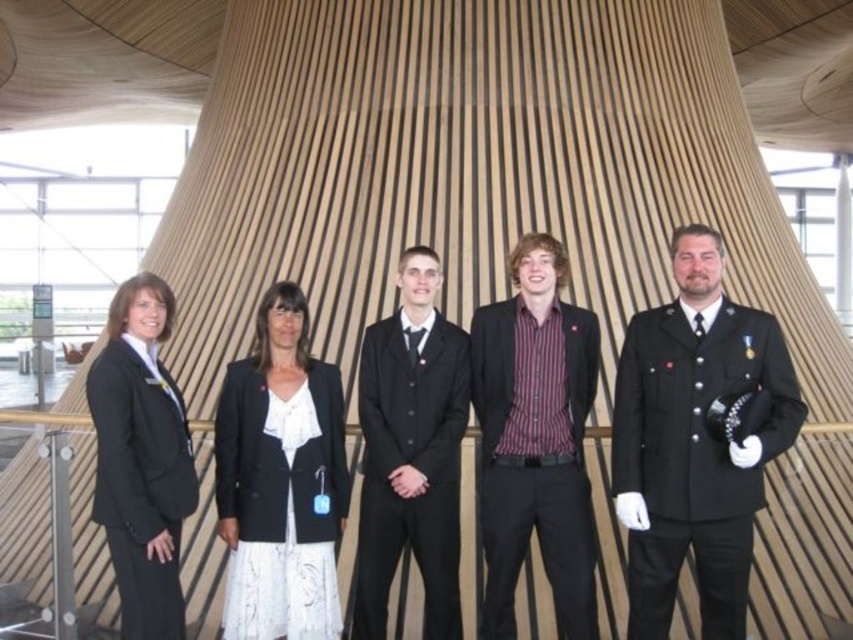
Question: Which point is closer to the camera?

Choices:
 (A) (143, 605)
 (B) (247, 451)
 (C) (701, 452)

Answer: (A)

Question: Where is black matte blazer at center located in relation to black satin suit at center in the image?

Choices:
 (A) above
 (B) below

Answer: (B)

Question: Does shiny black uniform at right have a smaller size compared to black satin suit at center?

Choices:
 (A) yes
 (B) no

Answer: (B)

Question: Which point is closer to the camera?

Choices:
 (A) (x=424, y=513)
 (B) (x=260, y=432)

Answer: (A)

Question: Based on their relative distances, which object is farther from the black fabric suit at left?

Choices:
 (A) striped cotton shirt at center
 (B) shiny black uniform at right

Answer: (B)

Question: Can you confirm if shiny black uniform at right is smaller than black matte blazer at center?

Choices:
 (A) no
 (B) yes

Answer: (A)